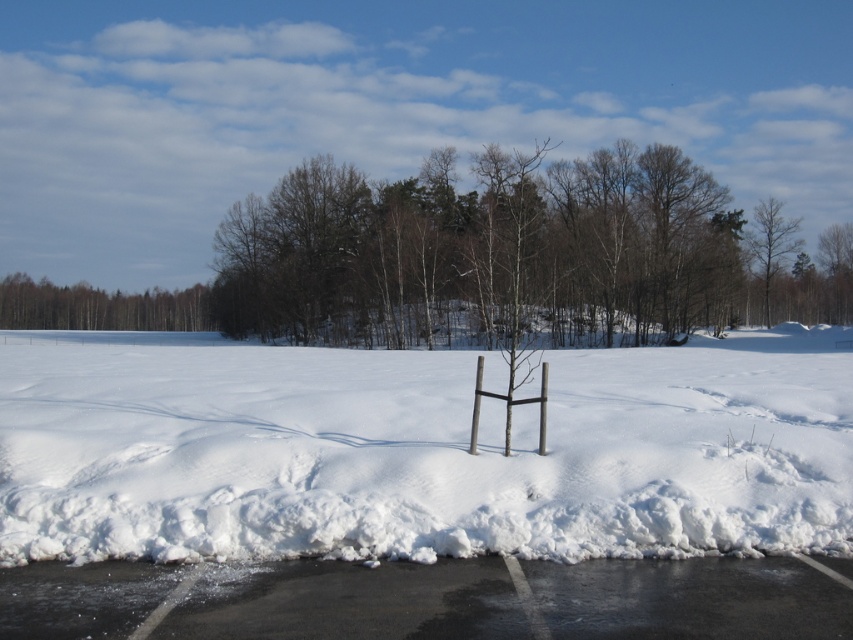
You are standing at the edge of the snow area and want to walk towards the bare wood tree at upper right. Which direction should you move relative to the white fluffy snow at center?

You should move to the right of the white fluffy snow at center because the bare wood tree at upper right is located to the right of the white fluffy snow at center.

You are a surveyor trying to locate the exact coordinates of the white fluffy snow at center in this winter landscape. What are its coordinates?

The white fluffy snow at center is located at coordinates point (418,449).

You are an artist planning to paint the winter landscape. You want to ensure the brown wood tree at upper left and the bare wood tree at upper right are proportionally accurate. Which tree should you make wider in your painting?

The brown wood tree at upper left should be made wider in the painting since its width surpasses that of the bare wood tree at upper right according to the description.